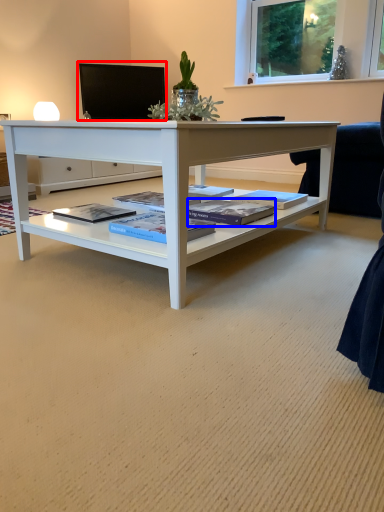
Question: Which object is further to the camera taking this photo, computer monitor (highlighted by a red box) or magazine (highlighted by a blue box)?

Choices:
 (A) computer monitor
 (B) magazine

Answer: (A)